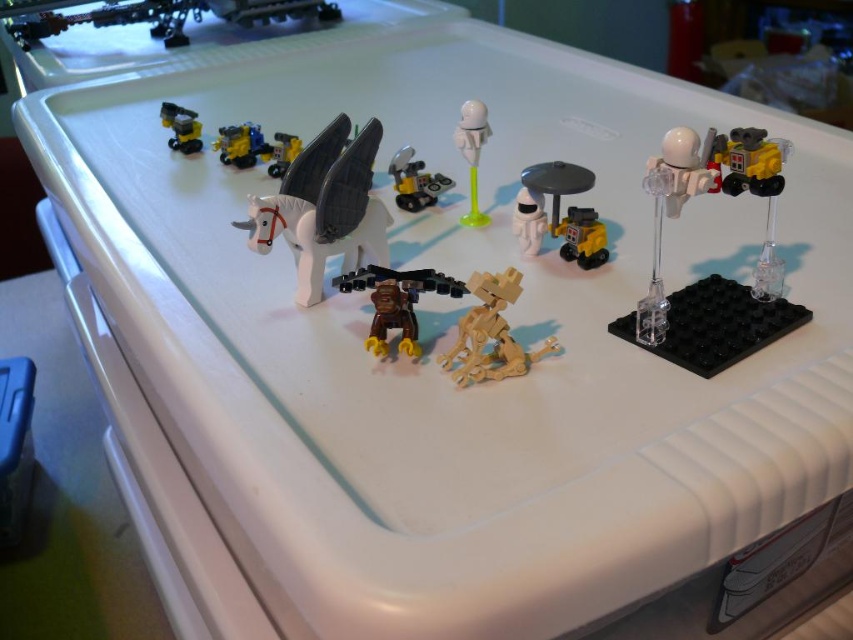
Does brown plastic gorilla at center appear over translucent white plastic astronaut at center?

No, brown plastic gorilla at center is not above translucent white plastic astronaut at center.

Who is taller, brown plastic gorilla at center or translucent white plastic astronaut at center?

Standing taller between the two is translucent white plastic astronaut at center.

Is point (374, 339) in front of point (485, 136)?

Yes, it is.

This screenshot has width=853, height=640. Identify the location of brown plastic gorilla at center. (396, 301).

Measure the distance from metallic yellow and blue vehicle at upper left to metallic yellow and black vehicle at upper left.

A distance of 3.41 inches exists between metallic yellow and blue vehicle at upper left and metallic yellow and black vehicle at upper left.

Between metallic yellow and blue vehicle at upper left and metallic yellow and black vehicle at upper left, which one appears on the left side from the viewer's perspective?

From the viewer's perspective, metallic yellow and black vehicle at upper left appears more on the left side.

Find the location of a particular element. The image size is (853, 640). metallic yellow and blue vehicle at upper left is located at coordinates (241, 145).

Who is taller, wooden figure at center or yellow plastic robot at upper right?

wooden figure at center is taller.

I want to click on wooden figure at center, so click(x=490, y=333).

Which is behind, point (456, 340) or point (715, 179)?

The point (456, 340) is behind.

The height and width of the screenshot is (640, 853). In order to click on wooden figure at center in this screenshot , I will do `click(490, 333)`.